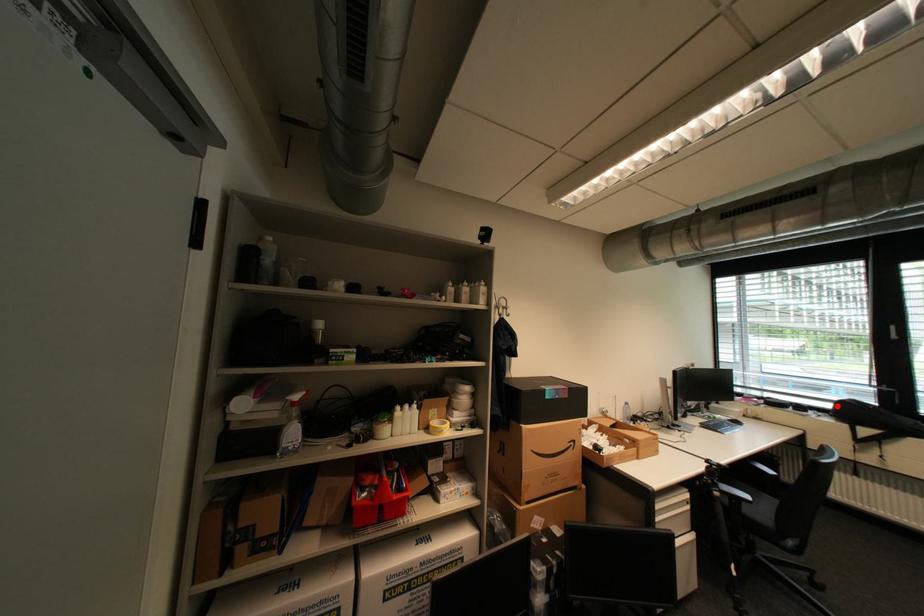
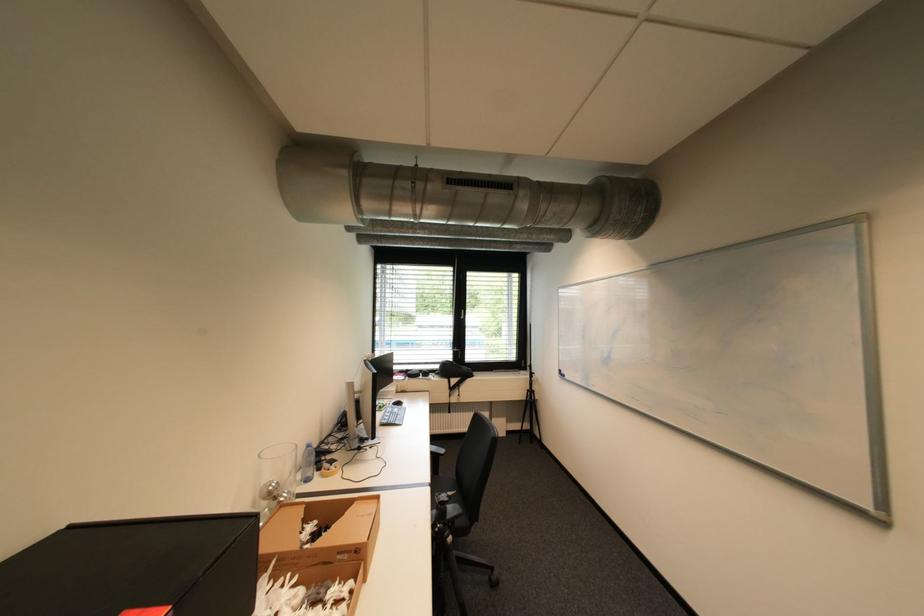
Question: I am providing you with two images of the same scene from different viewpoints. In image1, a red point is highlighted. Considering the same 3D point in image2, which of the following is correct?

Choices:
 (A) It is closer
 (B) It is farther

Answer: (B)